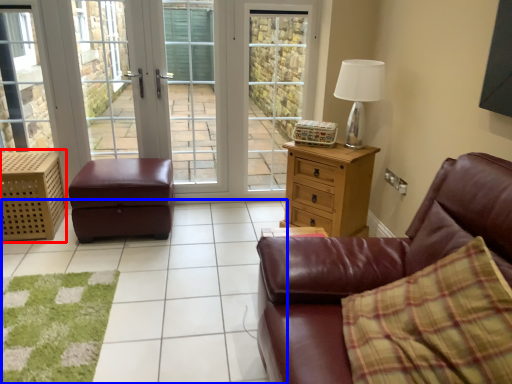
Question: Among these objects, which one is farthest to the camera, dresser (highlighted by a red box) or tile (highlighted by a blue box)?

Choices:
 (A) dresser
 (B) tile

Answer: (A)